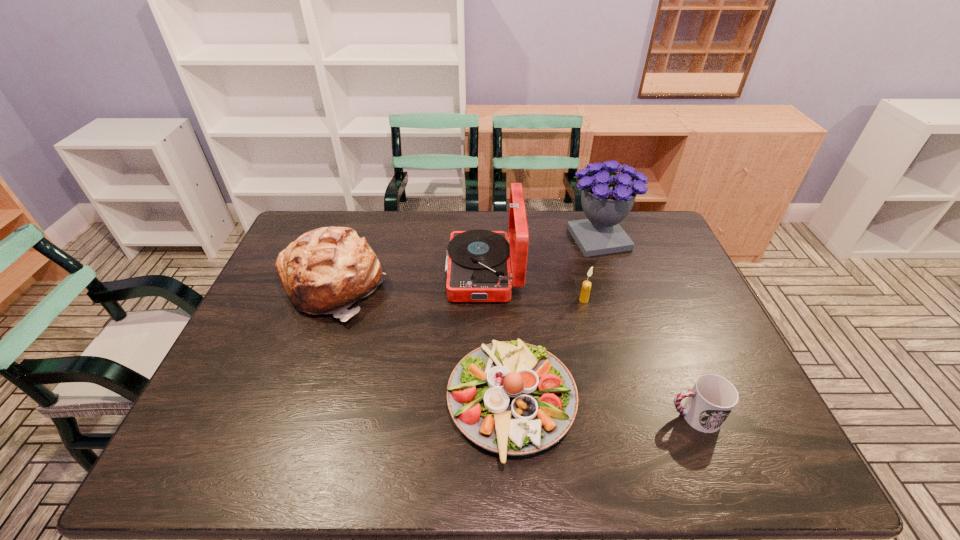
This screenshot has width=960, height=540. In the image, there is a desktop. Identify the location of free space at the far right corner. (660, 233).

Image resolution: width=960 pixels, height=540 pixels. Identify the location of free space between the cup and the fourth tallest object. (638, 358).

This screenshot has width=960, height=540. What are the coordinates of `free area in between the salad plate and the bouquet` in the screenshot? It's located at (556, 321).

The width and height of the screenshot is (960, 540). In order to click on free point between the phonograph_record and the fourth tallest object in this screenshot , I will do `click(534, 286)`.

At what (x,y) coordinates should I click in order to perform the action: click on blank region between the salad plate and the fourth shortest object. Please return your answer as a coordinate pair (x, y). Looking at the image, I should click on (422, 345).

Where is `free spot between the bouquet and the cup`? The height and width of the screenshot is (540, 960). free spot between the bouquet and the cup is located at coordinates (646, 327).

This screenshot has height=540, width=960. I want to click on vacant area that lies between the cup and the fourth tallest object, so click(638, 358).

This screenshot has height=540, width=960. I want to click on empty location between the phonograph_record and the salad plate, so click(497, 338).

Locate which object ranks second in proximity to the cup. Please provide its 2D coordinates. Your answer should be formatted as a tuple, i.e. [(x, y)], where the tuple contains the x and y coordinates of a point satisfying the conditions above.

[(586, 286)]

Find the location of a particular element. This screenshot has width=960, height=540. object that is the third closest to the cup is located at coordinates (478, 269).